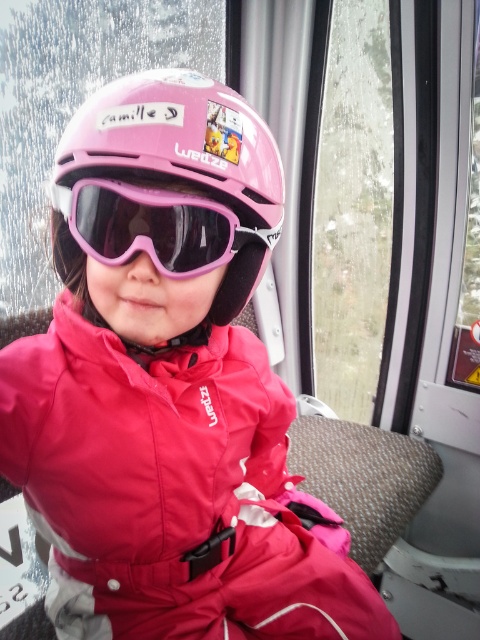
Question: Which point is closer to the camera?

Choices:
 (A) pink matte helmet at center
 (B) pink matte/glossy goggles at center

Answer: (A)

Question: Considering the relative positions of pink matte helmet at center and pink matte/glossy goggles at center in the image provided, where is pink matte helmet at center located with respect to pink matte/glossy goggles at center?

Choices:
 (A) above
 (B) below

Answer: (A)

Question: Does pink matte helmet at center appear over pink matte/glossy goggles at center?

Choices:
 (A) no
 (B) yes

Answer: (B)

Question: Which of the following is the farthest from the observer?

Choices:
 (A) pink matte helmet at center
 (B) pink matte/glossy goggles at center

Answer: (B)

Question: Does pink matte helmet at center have a greater width compared to pink matte/glossy goggles at center?

Choices:
 (A) yes
 (B) no

Answer: (A)